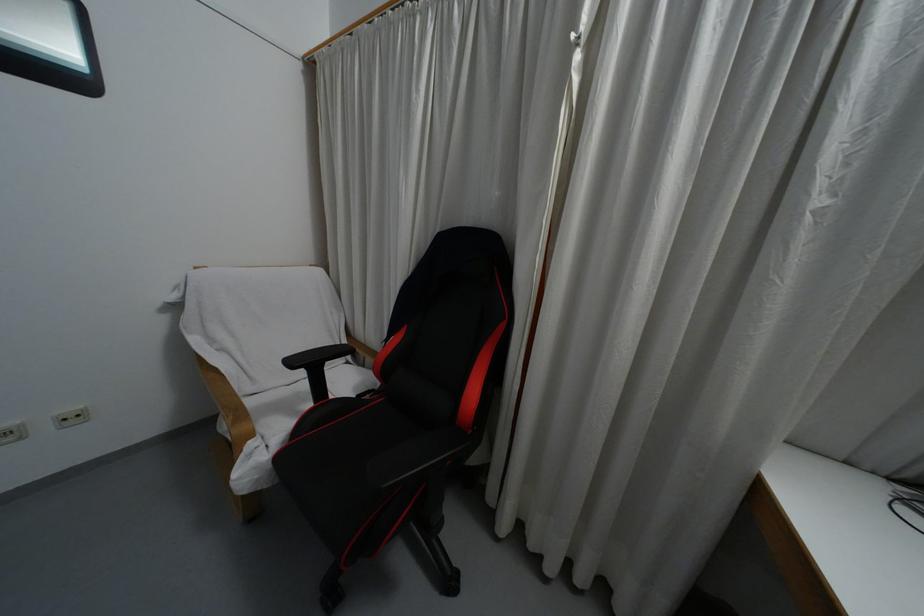
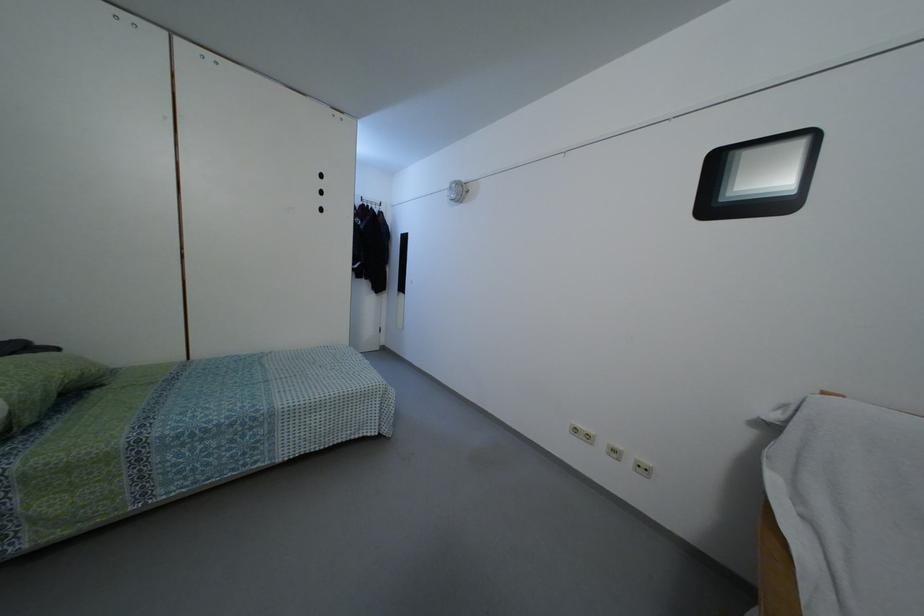
Question: Based on the continuous images, in which direction is the camera rotating? Reply with the corresponding letter.

Choices:
 (A) Left
 (B) Right
 (C) Up
 (D) Down

Answer: (A)